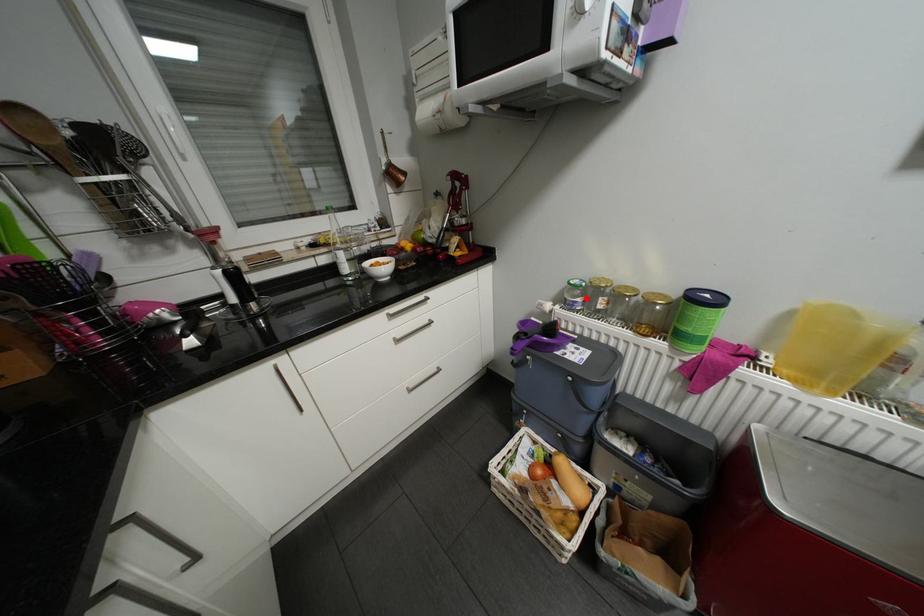
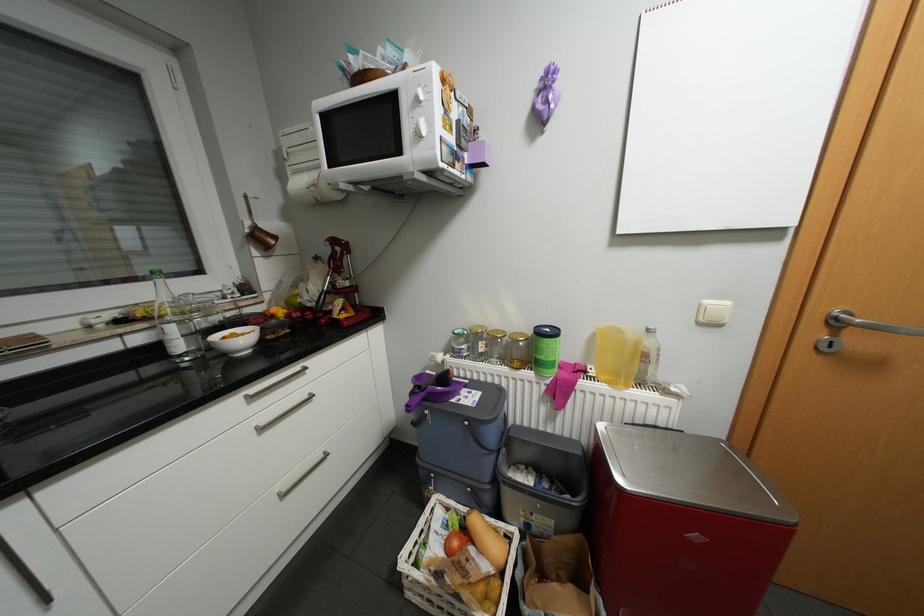
Locate, in the second image, the point that corresponds to the highlighted location in the first image.

(471, 345)